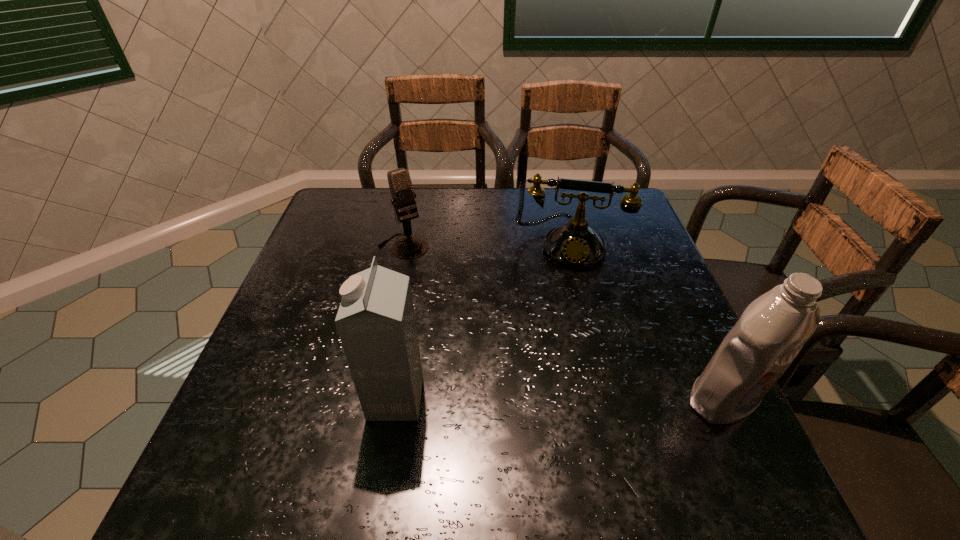
This screenshot has height=540, width=960. What are the coordinates of `vacant space located 0.060m on the front-facing side of the microphone` in the screenshot? It's located at (422, 271).

The image size is (960, 540). I want to click on free region located on the dial of the telephone, so click(556, 375).

The width and height of the screenshot is (960, 540). Identify the location of vacant space situated 0.390m on the dial of the telephone. (554, 400).

Find the location of a particular element. The image size is (960, 540). vacant space located 0.260m on the dial of the telephone is located at coordinates (558, 348).

Locate an element on the screen. This screenshot has width=960, height=540. object at the far edge is located at coordinates (575, 245).

Locate an element on the screen. carton located at the near edge is located at coordinates (x=375, y=321).

The height and width of the screenshot is (540, 960). Find the location of `detergent that is at the near edge`. detergent that is at the near edge is located at coordinates (771, 331).

In order to click on detergent that is at the right edge in this screenshot , I will do `click(771, 331)`.

Find the location of a particular element. This screenshot has width=960, height=540. telephone that is at the right edge is located at coordinates (575, 245).

This screenshot has height=540, width=960. Identify the location of object that is at the far right corner. (575, 245).